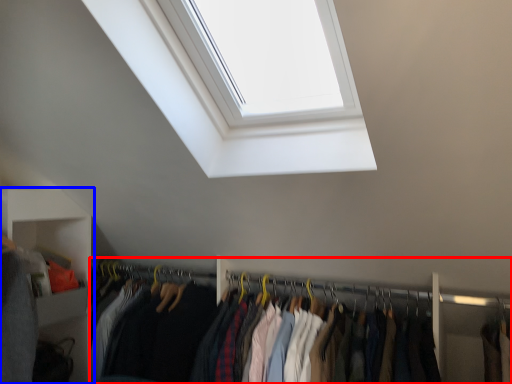
Question: Which object is further to the camera taking this photo, closet (highlighted by a red box) or shelf (highlighted by a blue box)?

Choices:
 (A) closet
 (B) shelf

Answer: (B)